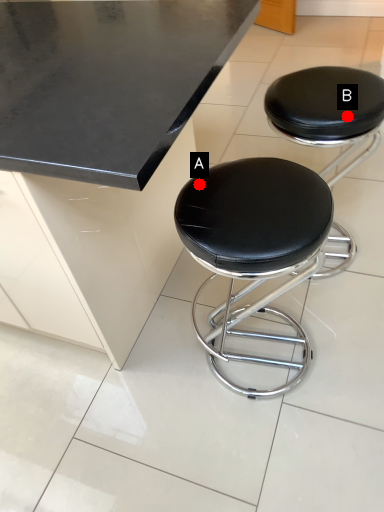
Question: Two points are circled on the image, labeled by A and B beside each circle. Which point is closer to the camera taking this photo?

Choices:
 (A) A is closer
 (B) B is closer

Answer: (A)